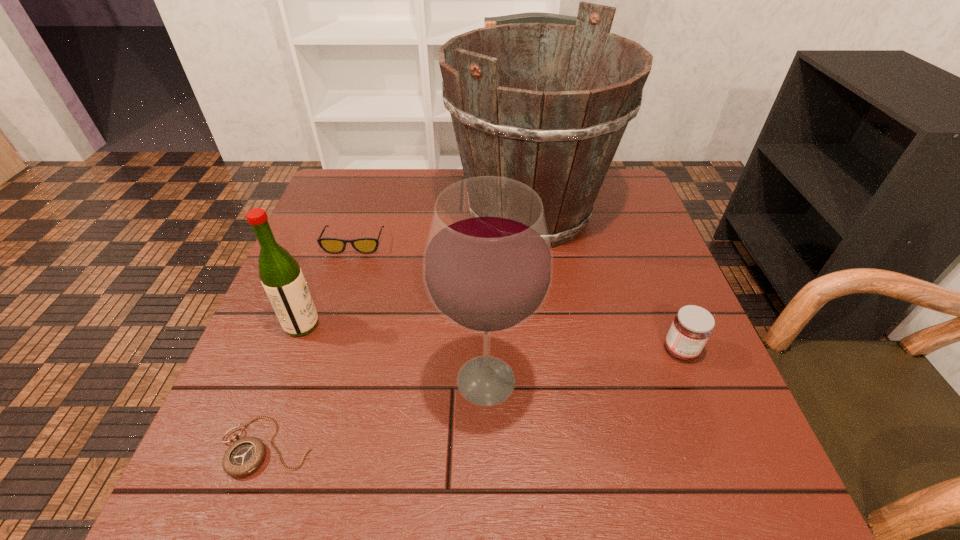
The width and height of the screenshot is (960, 540). Identify the location of bucket. (560, 138).

Where is `the second tallest object`? This screenshot has width=960, height=540. the second tallest object is located at coordinates (488, 264).

At what (x,y) coordinates should I click in order to perform the action: click on the fourth shortest object. Please return your answer as a coordinate pair (x, y). This screenshot has height=540, width=960. Looking at the image, I should click on (281, 276).

The image size is (960, 540). What are the coordinates of `jam` in the screenshot? It's located at (692, 326).

Locate an element on the screen. the third shortest object is located at coordinates (692, 326).

I want to click on sunglasses, so click(x=330, y=245).

The image size is (960, 540). Identify the location of pocket watch. tap(245, 455).

I want to click on vacant region located 0.300m on the left of the bucket, so click(x=339, y=212).

What are the coordinates of `vacant space located 0.100m on the right of the alcohol` in the screenshot? It's located at (589, 381).

What are the coordinates of `vacant region located 0.190m on the label of the third tallest object` in the screenshot? It's located at (408, 325).